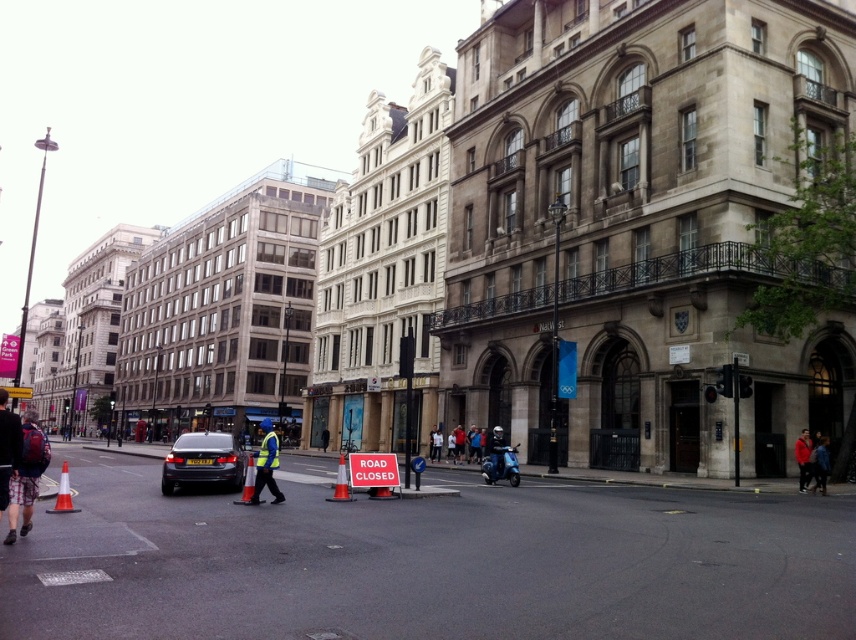
Is point (200, 440) behind point (801, 449)?

No.

Where is `matte black car at center`? The image size is (856, 640). matte black car at center is located at coordinates (203, 460).

Consider the image. Is matte black backpack at lower left bigger than yellow reflective vest at center?

Indeed, matte black backpack at lower left has a larger size compared to yellow reflective vest at center.

Between point (9, 540) and point (256, 499), which one is positioned in front?

Point (9, 540) is more forward.

You are a GUI agent. You are given a task and a screenshot of the screen. Output one action in this format:
    pyautogui.click(x=<x>, y=<y>)
    Task: Click on the matte black backpack at lower left
    The height and width of the screenshot is (640, 856).
    Given the screenshot: What is the action you would take?
    pyautogui.click(x=27, y=476)

Is orange plastic cone at center to the right of orange traffic cone at center from the viewer's perspective?

Yes, orange plastic cone at center is to the right of orange traffic cone at center.

Can you confirm if orange plastic cone at center is bigger than orange traffic cone at center?

Correct, orange plastic cone at center is larger in size than orange traffic cone at center.

Between point (342, 496) and point (250, 468), which one is positioned in front?

Point (250, 468) is in front.

You are a GUI agent. You are given a task and a screenshot of the screen. Output one action in this format:
    pyautogui.click(x=<x>, y=<y>)
    Task: Click on the orange plastic cone at center
    The width and height of the screenshot is (856, 640).
    Given the screenshot: What is the action you would take?
    pyautogui.click(x=340, y=483)